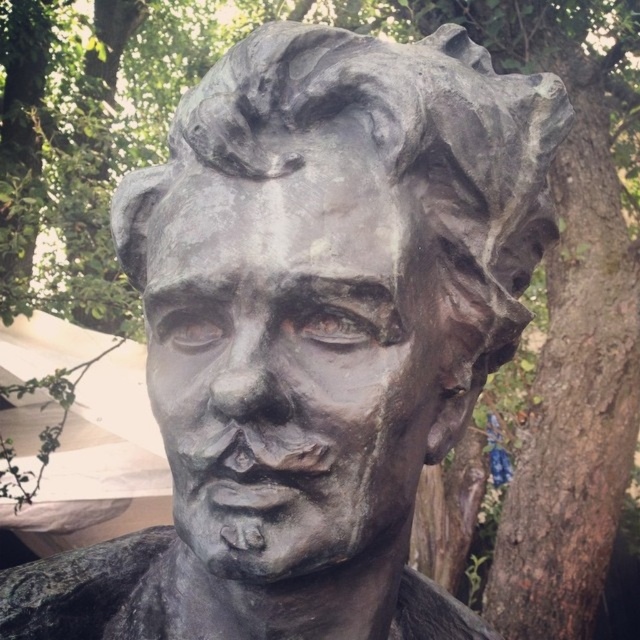
Looking at this image, is bronze statue at center below bronze sculpture at center?

Incorrect, bronze statue at center is not positioned below bronze sculpture at center.

Is bronze statue at center further to camera compared to bronze sculpture at center?

Yes, bronze statue at center is further from the viewer.

Between point (419, 216) and point (314, 472), which one is positioned in front?

Positioned in front is point (314, 472).

This screenshot has height=640, width=640. In order to click on bronze statue at center in this screenshot , I will do `click(332, 276)`.